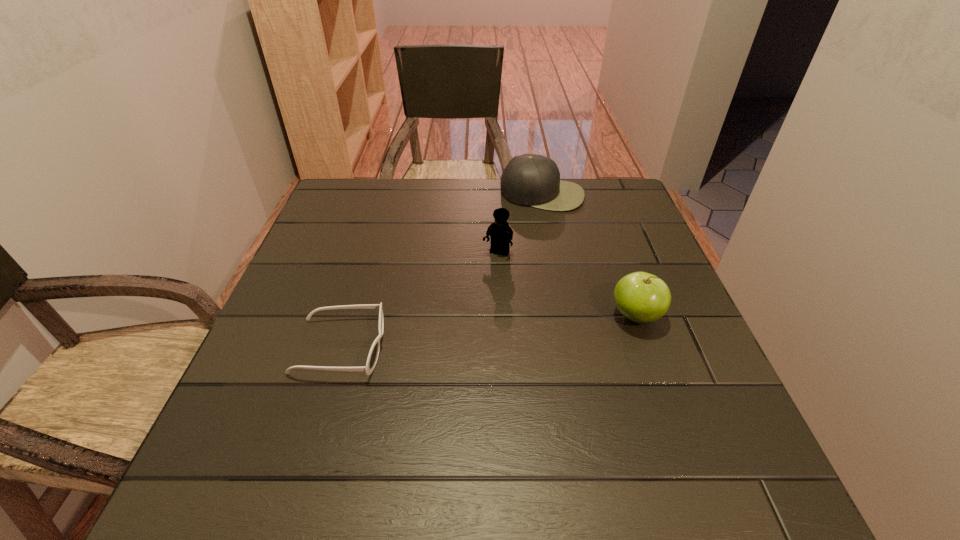
At what (x,y) coordinates should I click in order to perform the action: click on free space located on the brim of the cap. Please return your answer as a coordinate pair (x, y). Looking at the image, I should click on (511, 289).

This screenshot has height=540, width=960. In order to click on vacant space positioned on the brim of the cap in this screenshot , I will do `click(529, 230)`.

Locate an element on the screen. The image size is (960, 540). vacant space located 0.400m on the brim of the cap is located at coordinates (505, 310).

Image resolution: width=960 pixels, height=540 pixels. I want to click on object present at the far edge, so click(x=533, y=180).

The image size is (960, 540). Find the location of `object at the left edge`. object at the left edge is located at coordinates (373, 354).

The height and width of the screenshot is (540, 960). Identify the location of apple that is at the right edge. (641, 297).

Where is `cap located in the right edge section of the desktop`? This screenshot has width=960, height=540. cap located in the right edge section of the desktop is located at coordinates (533, 180).

In order to click on object present at the far right corner in this screenshot , I will do `click(533, 180)`.

Image resolution: width=960 pixels, height=540 pixels. In the image, there is a desktop. In order to click on blank space at the far edge in this screenshot , I will do click(x=437, y=206).

Find the location of a particular element. The height and width of the screenshot is (540, 960). free spot at the near edge of the desktop is located at coordinates (382, 420).